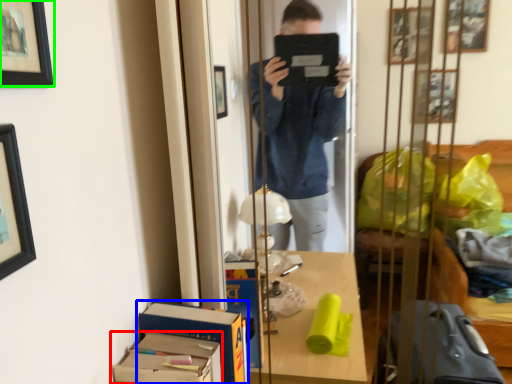
Question: Which object is positioned farthest from cardboard box (highlighted by a red box)? Select from cardboard box (highlighted by a blue box) and picture frame (highlighted by a green box).

Choices:
 (A) cardboard box
 (B) picture frame

Answer: (B)